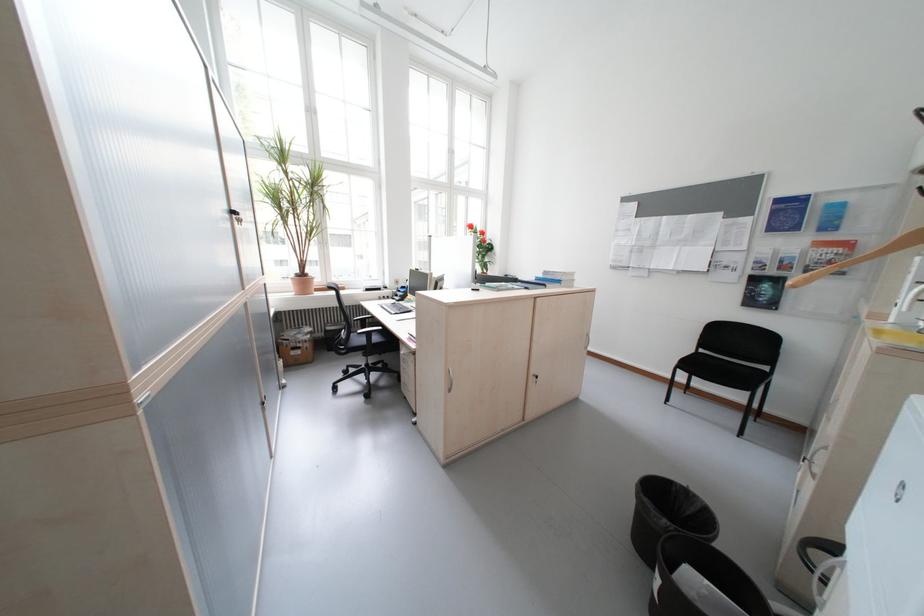
This screenshot has height=616, width=924. I want to click on black trash bin, so click(666, 515).